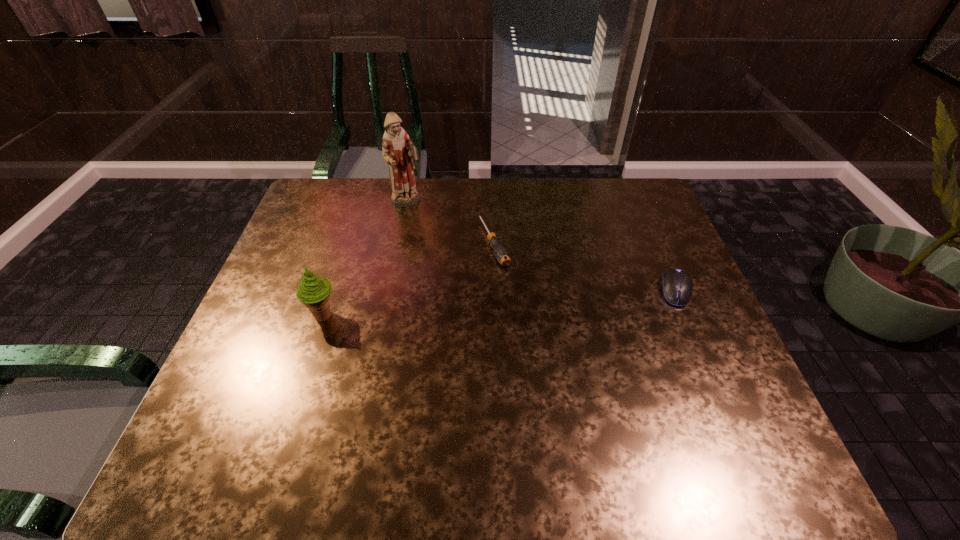
This screenshot has width=960, height=540. In the image, there is a desktop. Find the location of `vacant space at the near edge`. vacant space at the near edge is located at coordinates (434, 410).

The image size is (960, 540). Identify the location of free space at the left edge of the desktop. [313, 226].

The image size is (960, 540). Identify the location of blank space at the right edge of the desktop. (625, 252).

At what (x,y) coordinates should I click in order to perform the action: click on vacant space at the far left corner of the desktop. Please return your answer as a coordinate pair (x, y). This screenshot has width=960, height=540. Looking at the image, I should click on (353, 184).

Identify the location of vacant space at the far right corner of the desktop. This screenshot has height=540, width=960. (616, 200).

The image size is (960, 540). In the image, there is a desktop. What are the coordinates of `vacant space at the near right corner` in the screenshot? It's located at (744, 409).

Locate an element on the screen. vacant space in between the third object from right to left and the rightmost object is located at coordinates (541, 246).

This screenshot has width=960, height=540. Identify the location of free space between the rightmost object and the tallest object. (541, 246).

Find the location of a particular element. The width and height of the screenshot is (960, 540). vacant space in between the tallest object and the computer mouse is located at coordinates (541, 246).

This screenshot has height=540, width=960. In order to click on vacant point located between the third nearest object and the second object from left to right in this screenshot , I will do `click(450, 222)`.